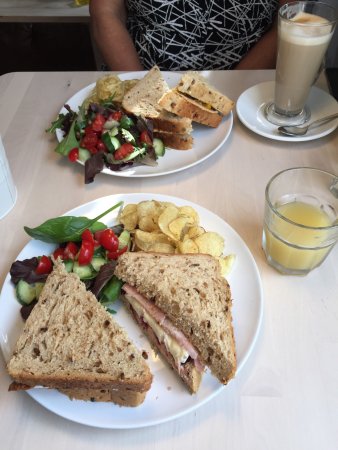
Locate an element on the screen. white table surface is located at coordinates (280, 353).